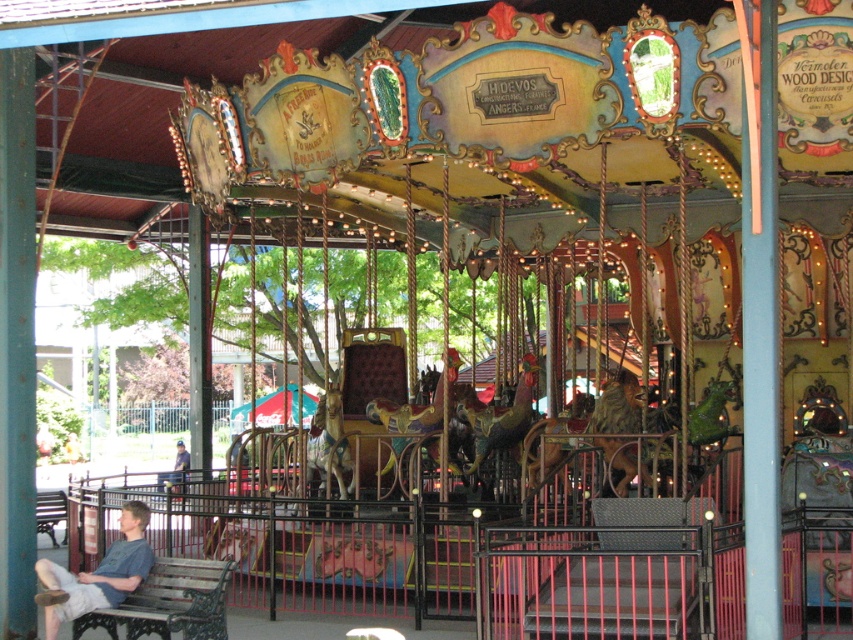
Does wooden bench at lower left have a greater width compared to light blue t-shirt at lower left?

Indeed, wooden bench at lower left has a greater width compared to light blue t-shirt at lower left.

Is point (149, 600) more distant than point (39, 577)?

No, (149, 600) is closer to viewer.

Find the location of a particular element. The image size is (853, 640). wooden bench at lower left is located at coordinates (169, 602).

Who is taller, light blue t-shirt at lower left or wooden park bench at lower left?

With more height is light blue t-shirt at lower left.

Between light blue t-shirt at lower left and wooden park bench at lower left, which one has less height?

Standing shorter between the two is wooden park bench at lower left.

Locate an element on the screen. The height and width of the screenshot is (640, 853). light blue t-shirt at lower left is located at coordinates (97, 573).

Find the location of a particular element. light blue t-shirt at lower left is located at coordinates (97, 573).

Based on the photo, who is taller, wooden bench at lower left or wooden park bench at lower left?

wooden bench at lower left is taller.

Between wooden bench at lower left and wooden park bench at lower left, which one is positioned higher?

Positioned higher is wooden bench at lower left.

Measure the distance between wooden bench at lower left and camera.

The distance of wooden bench at lower left from camera is 13.85 meters.

This screenshot has width=853, height=640. Identify the location of wooden bench at lower left. (169, 602).